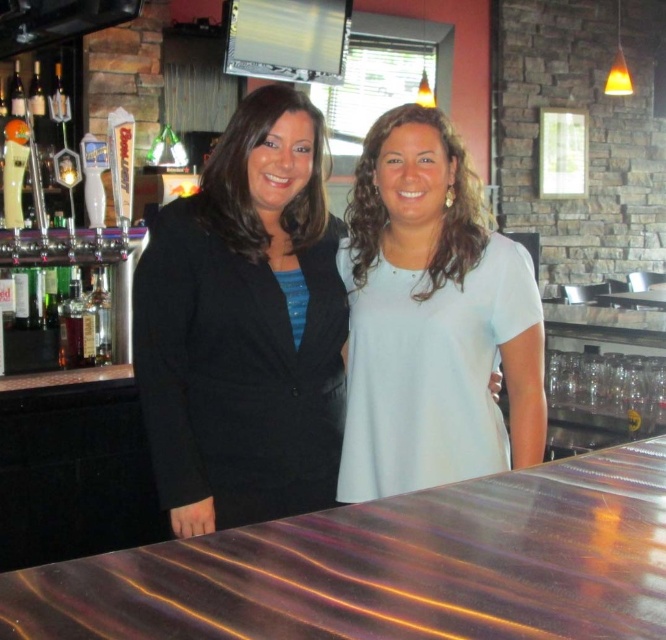
Which is above, black fabric jacket at center or light blue fabric shirt at center?

light blue fabric shirt at center is higher up.

This screenshot has width=666, height=640. Describe the element at coordinates (242, 326) in the screenshot. I see `black fabric jacket at center` at that location.

In the scene shown: Measure the distance between point [216,497] and camera.

1.59 meters

At what (x,y) coordinates should I click in order to perform the action: click on black fabric jacket at center. Please return your answer as a coordinate pair (x, y). The width and height of the screenshot is (666, 640). Looking at the image, I should click on (242, 326).